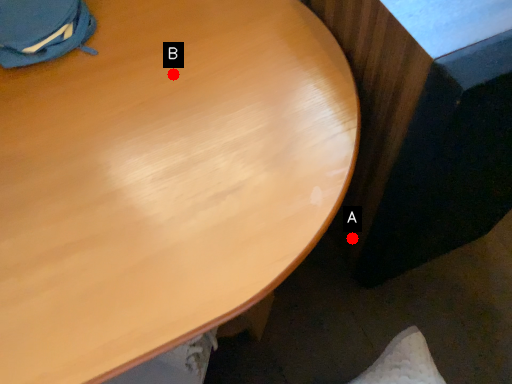
Question: Two points are circled on the image, labeled by A and B beside each circle. Which point is farther from the camera taking this photo?

Choices:
 (A) A is further
 (B) B is further

Answer: (A)